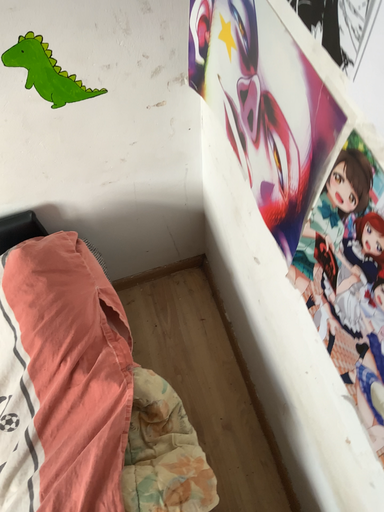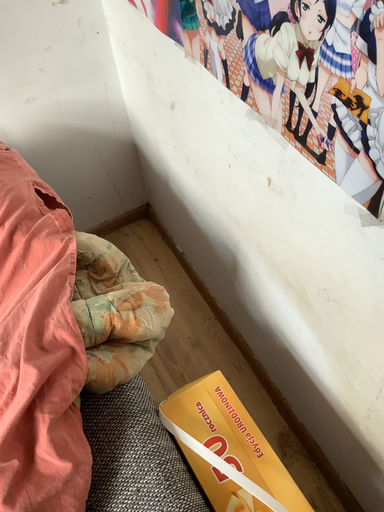
Question: Which way did the camera rotate in the video?

Choices:
 (A) rotated upward
 (B) rotated downward

Answer: (A)